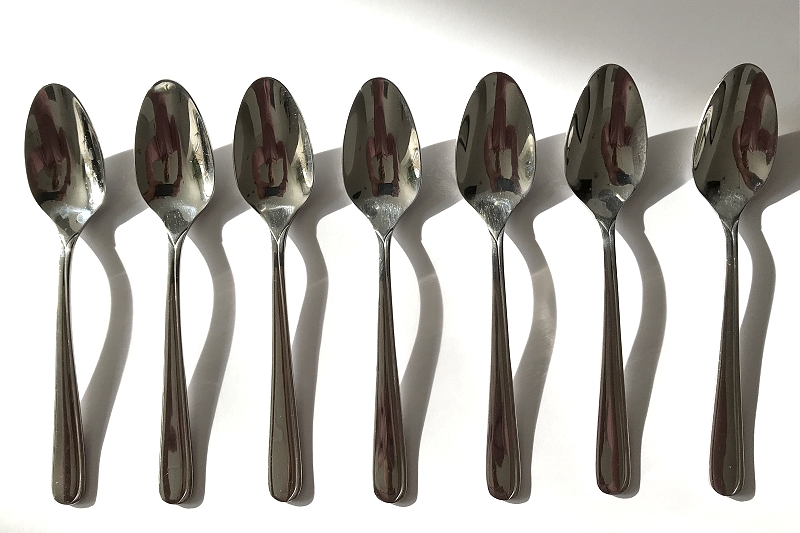
Where is `spoons`? This screenshot has height=533, width=800. spoons is located at coordinates (68, 185), (160, 174), (274, 158), (380, 148), (486, 148), (592, 142), (762, 134).